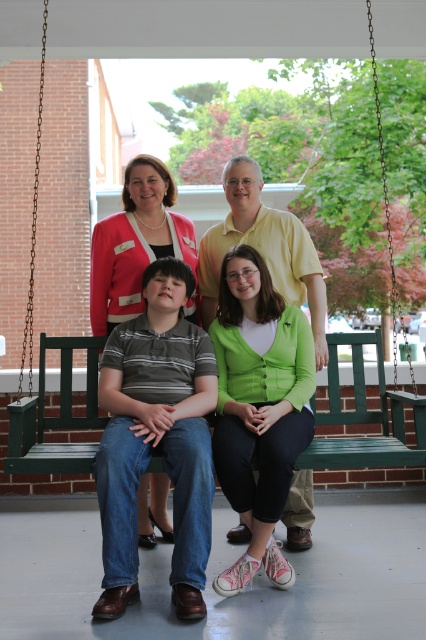
You are a photographer taking a picture of the matte striped shirt at center and the green wooden bench at center. Which object is closer to the camera?

The matte striped shirt at center is below the green wooden bench at center, so it is closer to the camera.

You are a photographer standing 2 meters away from the swing bench. You want to capture a photo that includes both the matte striped shirt at center and the matte green cardigan at center. Can you fit both into your camera frame without moving closer or further away?

The distance between the matte striped shirt at center and the matte green cardigan at center is 1.33 meters. Since you are 2 meters away from the swing bench, the camera frame should be able to accommodate both objects within the shot without needing to adjust your distance.

You are a photographer trying to capture a clear shot of the matte green cardigan at center and the green wooden bench at center. Since the bench is above the cardigan, where should you position your camera to ensure both are in the frame without any obstruction?

Position your camera below the green wooden bench at center so that it can capture both the bench above and the matte green cardigan at center in the frame without obstruction.